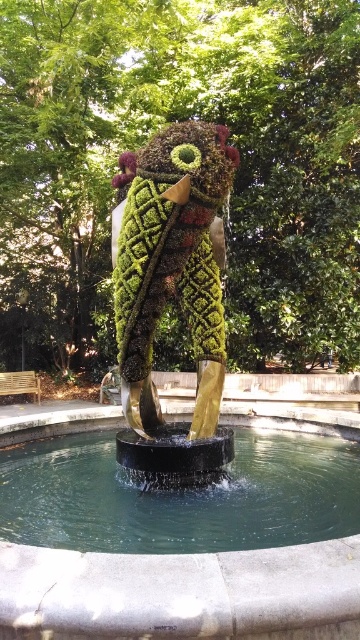
You are standing at the point labeled point (182, 547) in the park. You want to take a photo of the topiary sculpture from a distance of 3 meters. Can you move forward or backward to achieve this?

The distance between point (182, 547) and the camera is currently 2.80 meters. To achieve a 3 meter distance, you need to move backward slightly.

You are a maintenance worker who needs to clean the clear water at fountain center and the green mossy sculpture at center. If you have a 3 feet long cleaning tool, can you reach both objects from your current position without moving? Explain your reasoning.

The clear water at fountain center and green mossy sculpture at center are 3.30 feet apart. Since the distance between them is greater than the 3 feet length of your tool, you cannot reach both objects without moving closer to each one individually.

You are a landscape architect designing a new garden. You need to place a decorative statue that requires a base wider than its own width. Looking at the image, which object between the clear water at fountain center and the green mossy sculpture at center would be suitable for this requirement?

The clear water at fountain center has a greater width than the green mossy sculpture at center, so it would be suitable as the base since its width surpasses the sculpture.